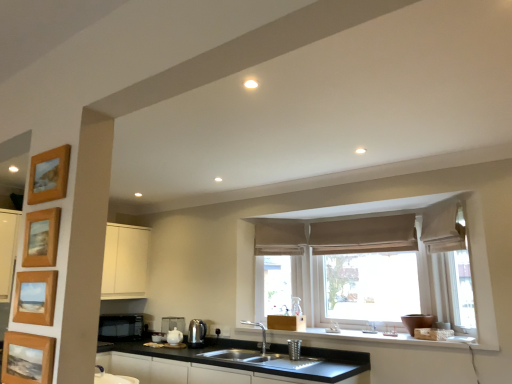
The width and height of the screenshot is (512, 384). What are the coordinates of `free location above beige fabric curtain at center, the second curtain positioned from the right (from a real-world perspective)` in the screenshot? It's located at pyautogui.click(x=368, y=218).